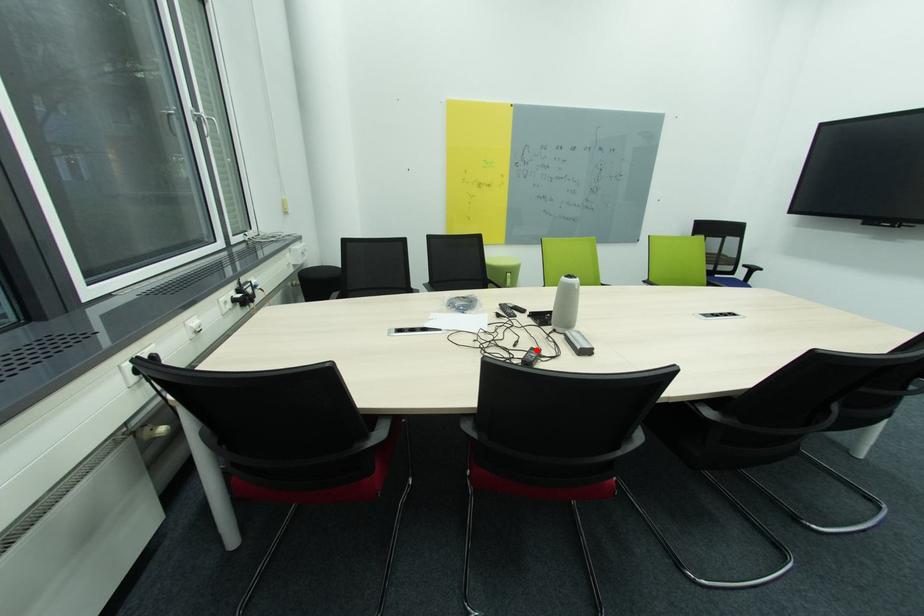
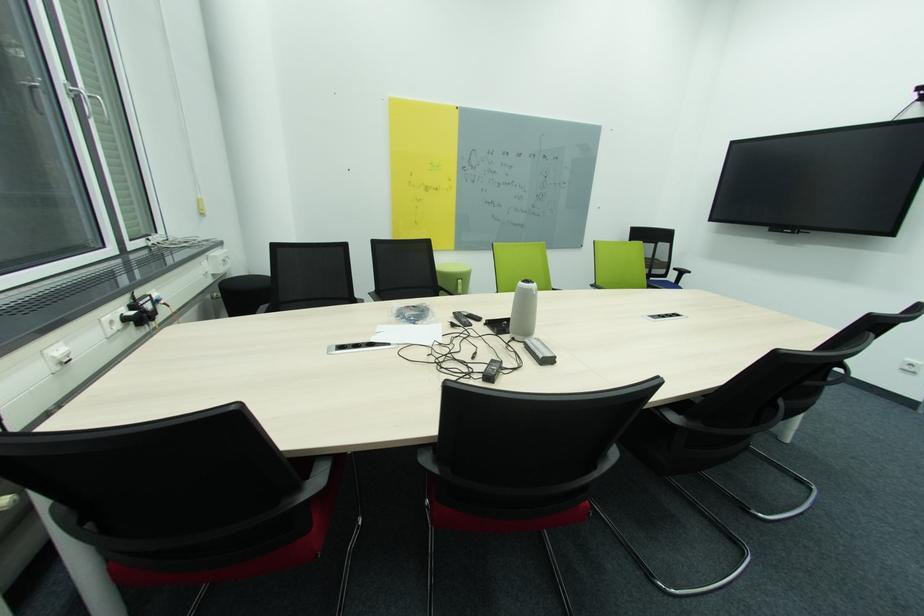
Where in the second image is the point corresponding to the highlighted location from the first image?

(497, 362)